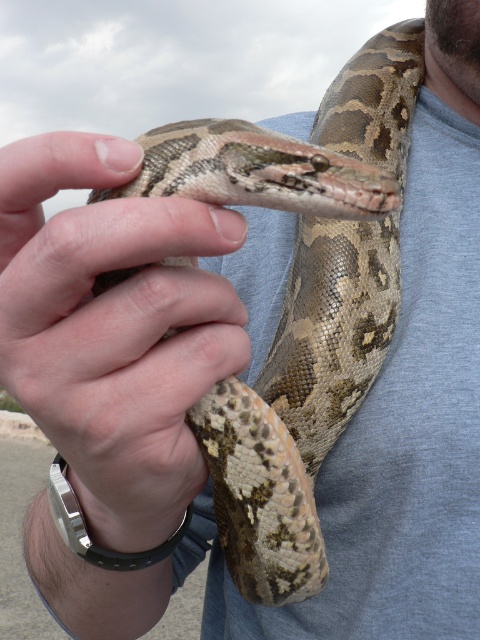
You are a wildlife photographer trying to capture a closeup shot of the snake. Your camera has a maximum focus range of 25 inches. Can you focus on both the leathery tan snake at center and the skinny neck at upper center at the same time?

The leathery tan snake at center and the skinny neck at upper center are 25.02 inches apart. Since the distance between them exceeds the camera maximum focus range of 25 inches, you cannot focus on both at the same time.